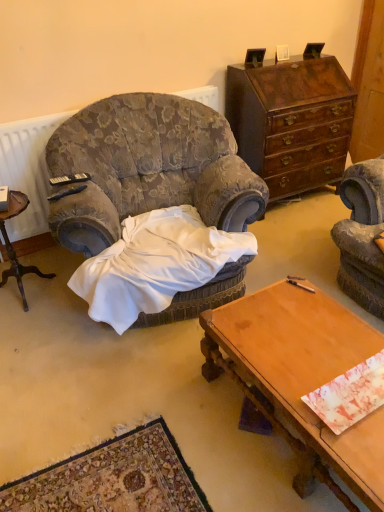
Question: Considering the positions of marbled paper at center and black plastic remote control at upper left, the 1th remote control positioned from the back, in the image, is marbled paper at center taller or shorter than black plastic remote control at upper left, the 1th remote control positioned from the back,?

Choices:
 (A) tall
 (B) short

Answer: (B)

Question: From the image's perspective, is marbled paper at center above or below black plastic remote control at upper left, the 1th remote control positioned from the back?

Choices:
 (A) above
 (B) below

Answer: (B)

Question: Estimate the real-world distances between objects in this image. Which object is farther from the white satin blanket at center?

Choices:
 (A) velvet-patterned armchair at center
 (B) wooden nightstand at left
 (C) black plastic remote control at left, the 1th remote control from the front
 (D) marbled paper at center
 (E) black plastic remote control at upper left, placed as the 2th remote control when sorted from front to back

Answer: (D)

Question: Based on their relative distances, which object is farther from the marbled paper at center?

Choices:
 (A) velvet-patterned armchair at center
 (B) wooden nightstand at left
 (C) white satin blanket at center
 (D) mahogany wood dresser at upper right
 (E) wooden desk at lower right

Answer: (D)